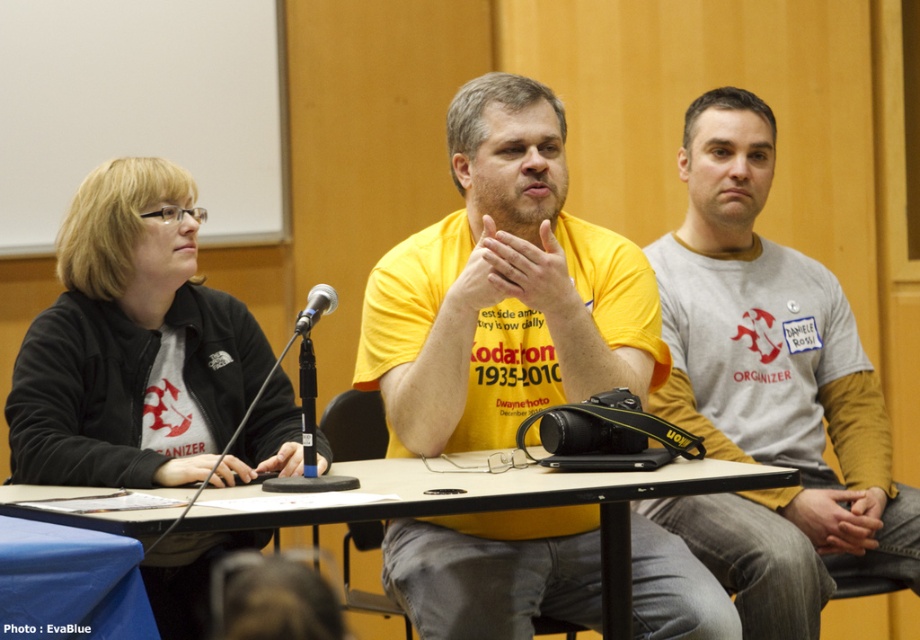
You are organizing a photo shoot and need to place a 12 inch wide camera bag between the black fabric jacket at left and the black metallic microphone at center. Can the camera bag fit in the space between them?

The black fabric jacket at left might be wider than the black metallic microphone at center, but the exact width isn

You are a photographer attending the event and need to capture a clear shot of the black metallic microphone at center without the black fabric jacket at left blocking it. Can you adjust your position to do so?

The black fabric jacket at left is further to the viewer than the black metallic microphone at center, so adjusting your position to the side or behind the microphone might allow you to capture it without obstruction.